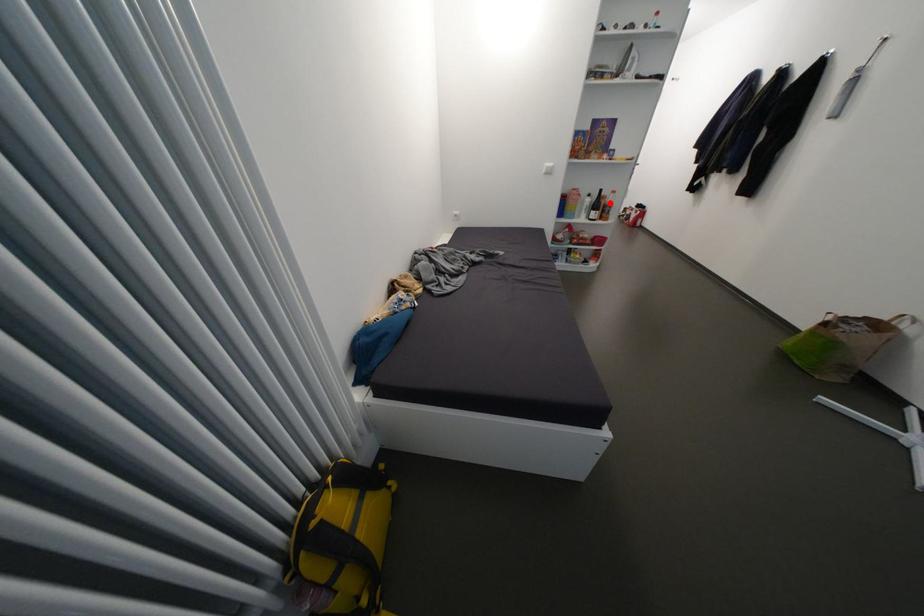
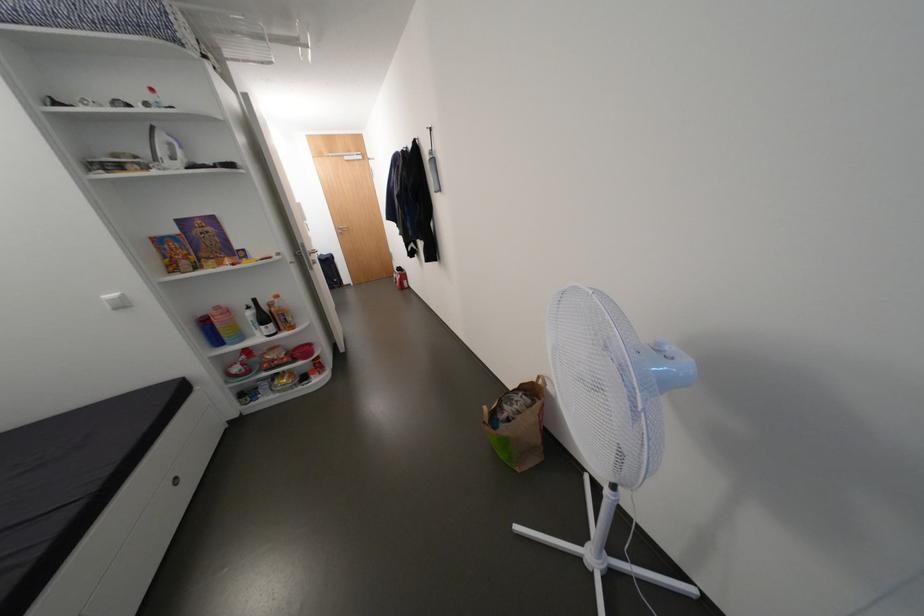
Locate, in the second image, the point that corresponds to the highlighted location in the first image.

(281, 310)